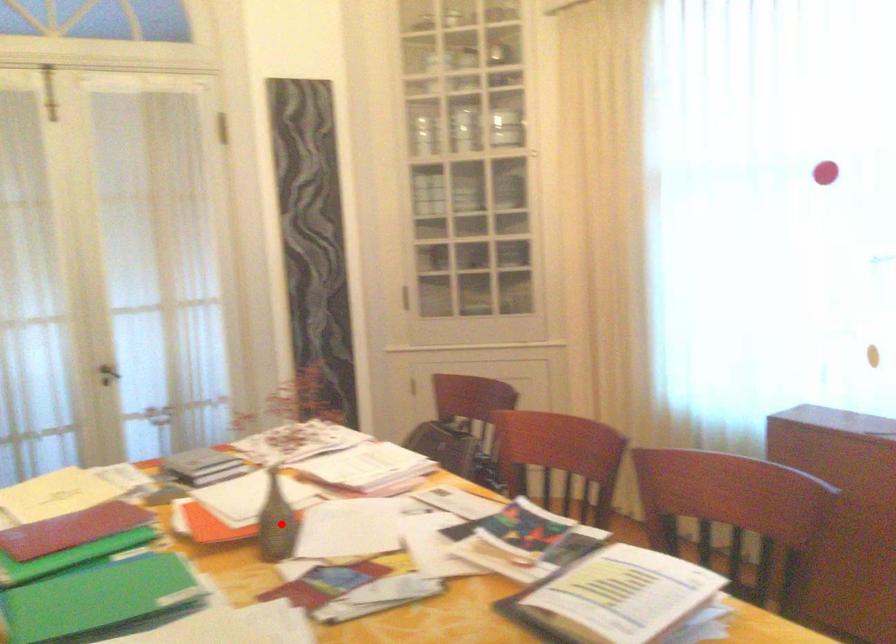
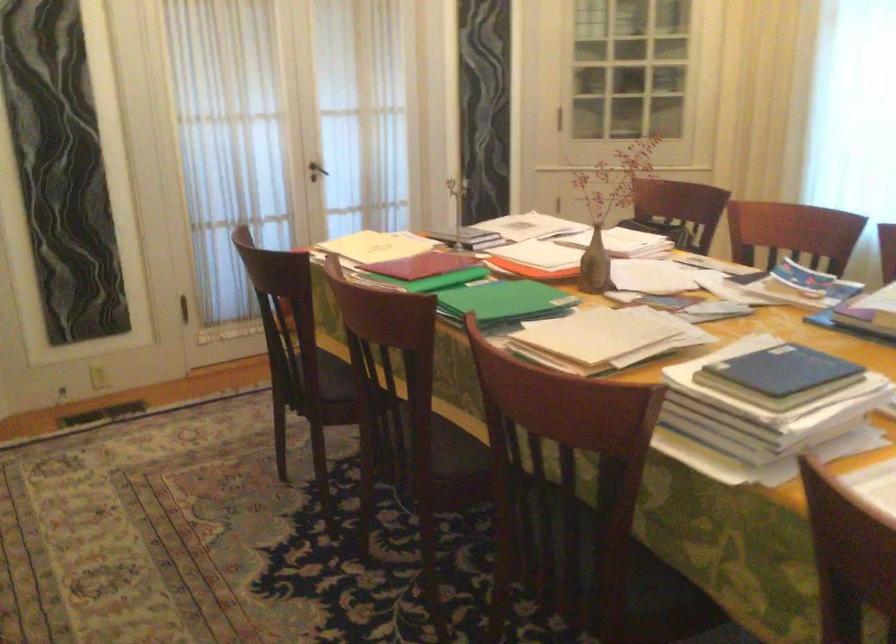
Question: I am providing you with two images of the same scene from different viewpoints. Given a red point in image1, look at the same physical point in image2. Is it:

Choices:
 (A) Closer to the viewpoint
 (B) Farther from the viewpoint

Answer: (B)